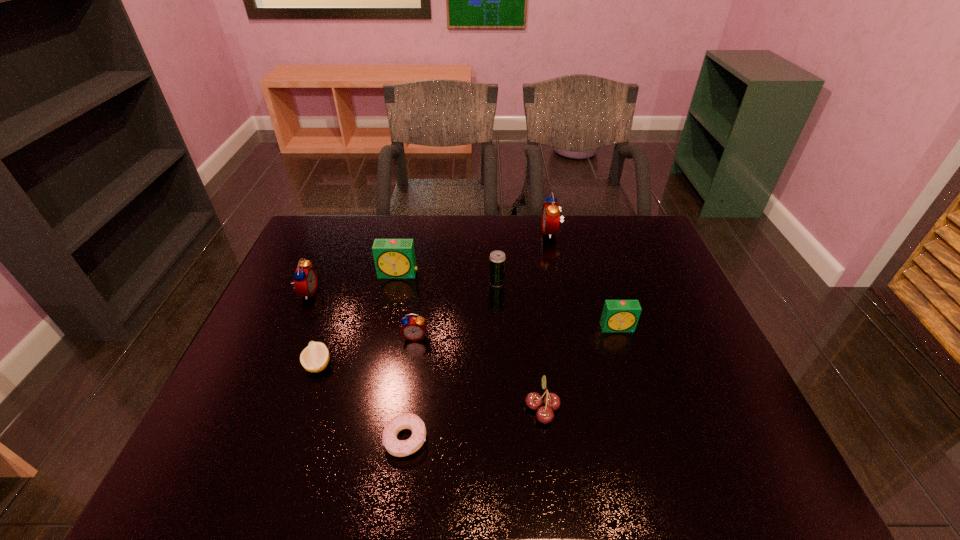
Locate an element on the screen. This screenshot has width=960, height=540. unoccupied position between the leftmost red alarm clock and the third nearest object is located at coordinates (313, 329).

This screenshot has height=540, width=960. In order to click on free spot between the smallest red alarm clock and the doughnut in this screenshot , I will do click(x=411, y=388).

I want to click on free spot between the third nearest alarm clock and the right green alarm clock, so click(463, 310).

Identify the location of free point between the rightmost red alarm clock and the beer can. The width and height of the screenshot is (960, 540). (524, 257).

Where is `free space between the rightmost object and the seventh farthest object`? The image size is (960, 540). free space between the rightmost object and the seventh farthest object is located at coordinates (468, 347).

Find the location of a particular element. Image resolution: width=960 pixels, height=540 pixels. free space that is in between the farthest object and the bigger green alarm clock is located at coordinates (474, 253).

Locate an element on the screen. This screenshot has width=960, height=540. vacant point located between the beer can and the right green alarm clock is located at coordinates (557, 305).

At what (x,y) coordinates should I click in order to perform the action: click on object that is the seventh nearest to the leftmost red alarm clock. Please return your answer as a coordinate pair (x, y). Looking at the image, I should click on (551, 210).

The width and height of the screenshot is (960, 540). In order to click on the fourth closest object to the second red alarm clock from left to right in this screenshot , I will do `click(497, 259)`.

Where is `alarm clock that is the third closest to the doughnut`? The height and width of the screenshot is (540, 960). alarm clock that is the third closest to the doughnut is located at coordinates (394, 258).